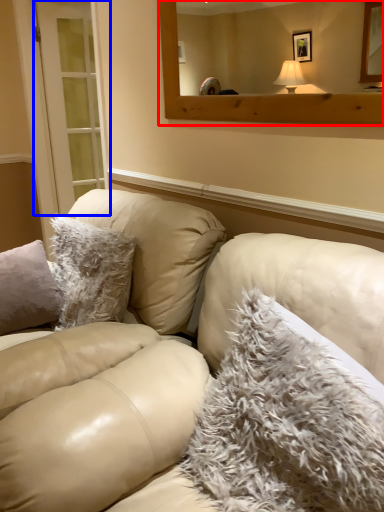
Question: Among these objects, which one is farthest to the camera, mirror (highlighted by a red box) or glass door (highlighted by a blue box)?

Choices:
 (A) mirror
 (B) glass door

Answer: (B)